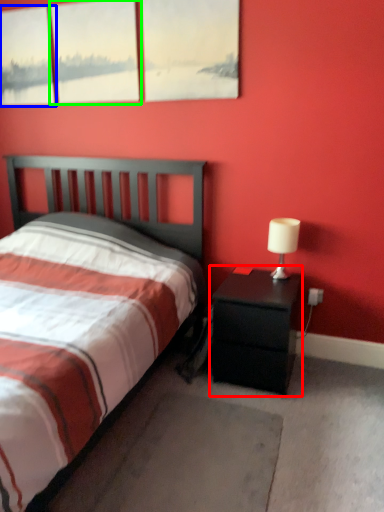
Question: Which object is the farthest from nightstand (highlighted by a red box)? Choose among these: window (highlighted by a blue box) or window (highlighted by a green box).

Choices:
 (A) window
 (B) window

Answer: (A)